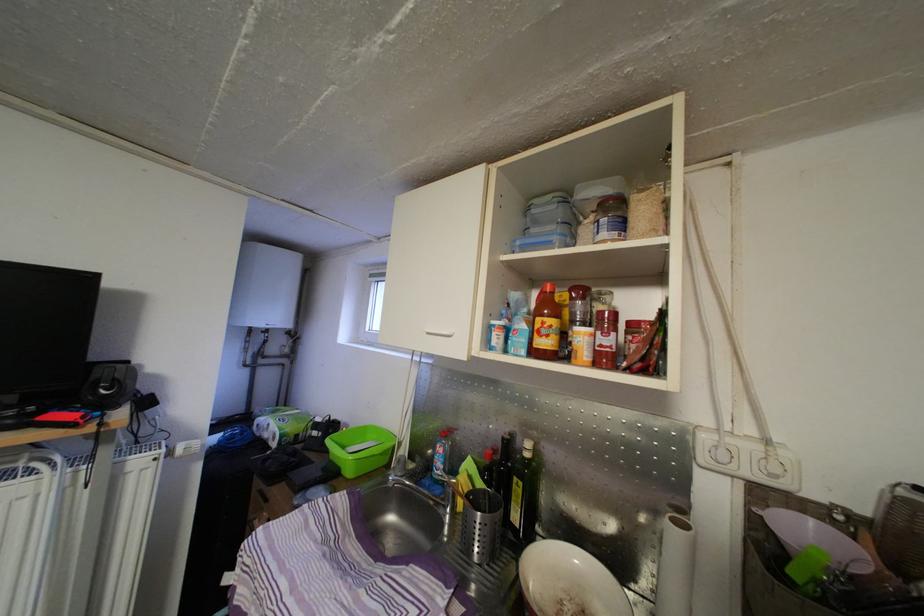
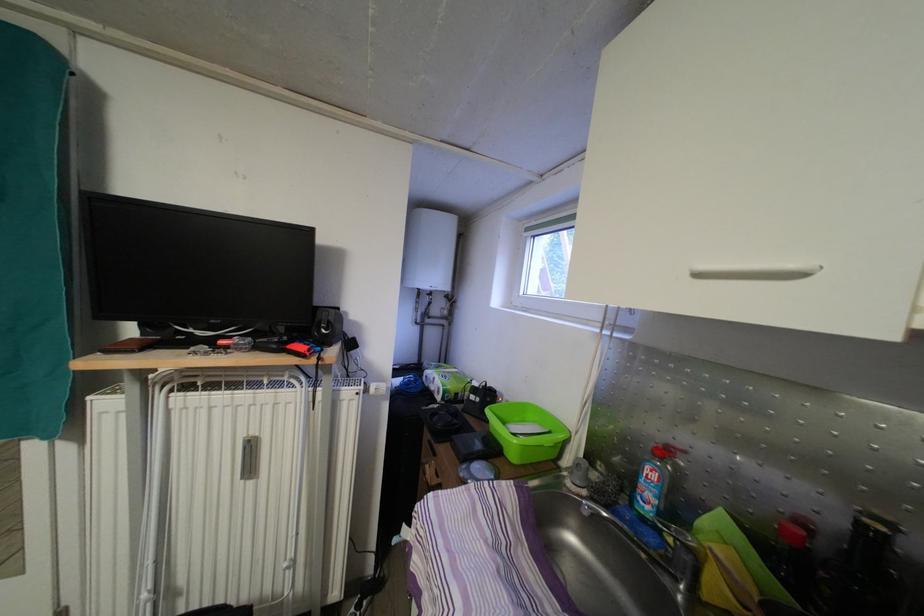
Question: Based on the continuous images, in which direction is the camera rotating? Reply with the corresponding letter.

Choices:
 (A) Left
 (B) Right
 (C) Up
 (D) Down

Answer: (A)